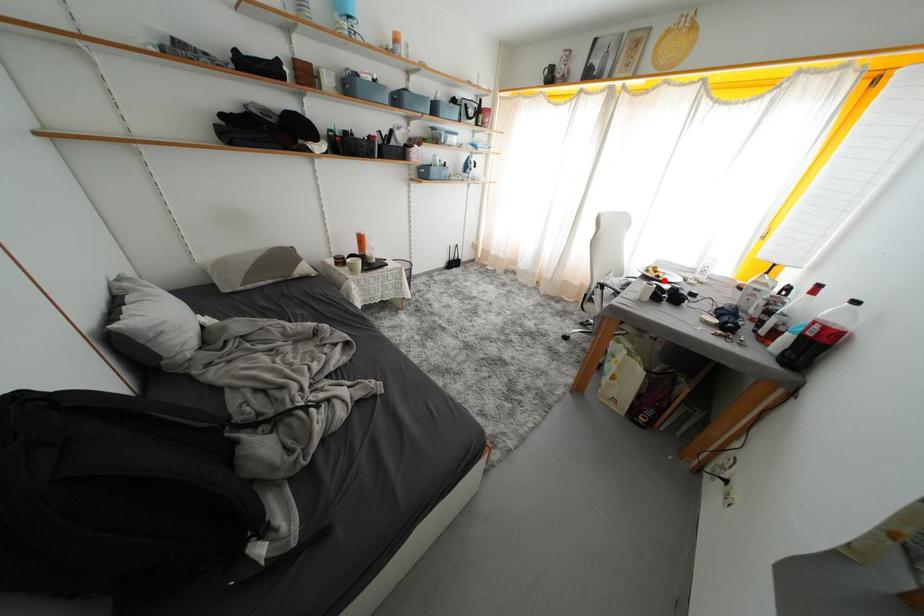
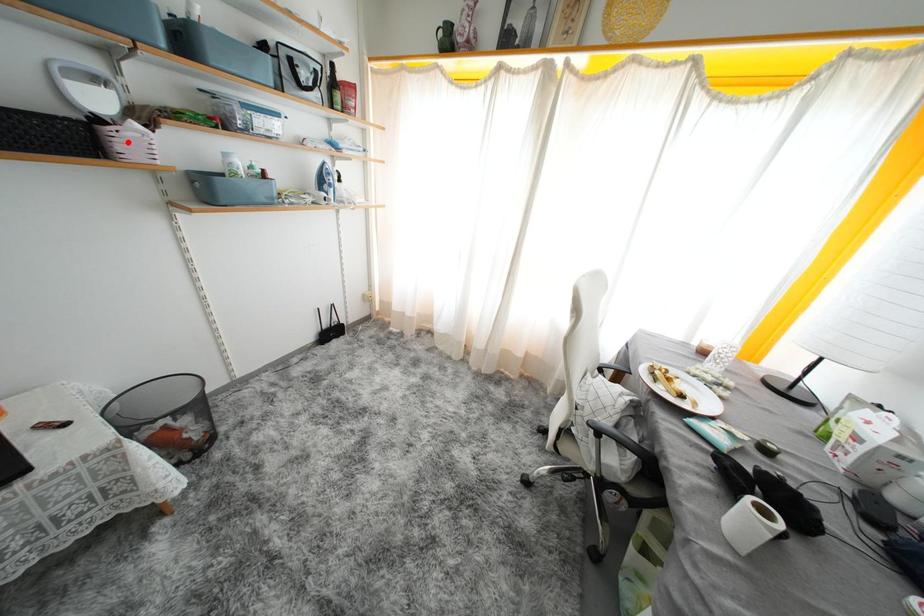
I am providing you with two images of the same scene from different viewpoints. A red point is marked on the first image and another point is marked on the second image. Is the red point in image1 aligned with the point shown in image2?

No